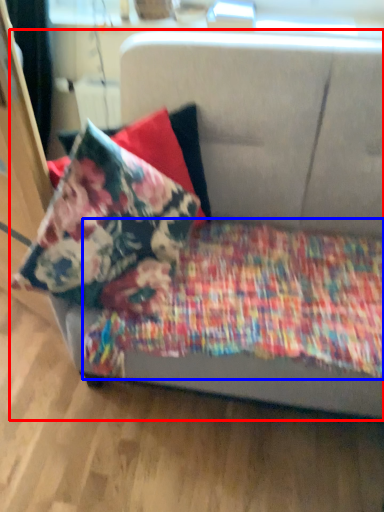
Question: Which of the following is the closest to the observer, studio couch (highlighted by a red box) or blanket (highlighted by a blue box)?

Choices:
 (A) studio couch
 (B) blanket

Answer: (A)